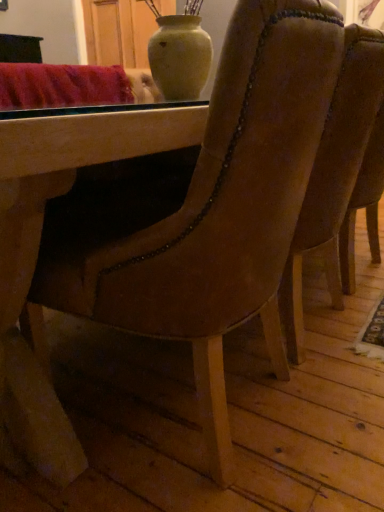
Locate an element on the screen. wooden table at center is located at coordinates (38, 250).

Image resolution: width=384 pixels, height=512 pixels. Describe the element at coordinates (38, 250) in the screenshot. I see `wooden table at center` at that location.

Measure the distance between point (27, 364) and camera.

Point (27, 364) is 36.42 inches from camera.

Where is `wooden table at center`? This screenshot has height=512, width=384. wooden table at center is located at coordinates coord(38,250).